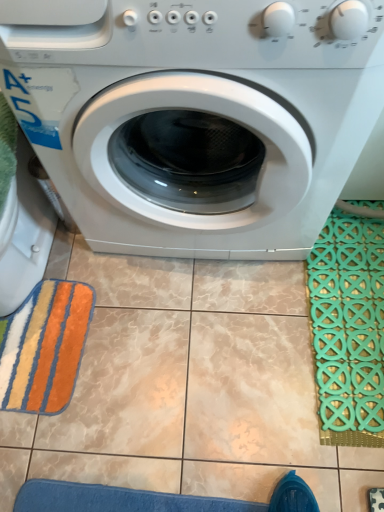
Question: Is green rubber bath mat at right taller than white glossy washing machine at center?

Choices:
 (A) no
 (B) yes

Answer: (A)

Question: From the image's perspective, is green rubber bath mat at right located above white glossy washing machine at center?

Choices:
 (A) no
 (B) yes

Answer: (A)

Question: Are green rubber bath mat at right and white glossy washing machine at center located far from each other?

Choices:
 (A) yes
 (B) no

Answer: (B)

Question: Considering the relative sizes of green rubber bath mat at right and white glossy washing machine at center in the image provided, is green rubber bath mat at right wider than white glossy washing machine at center?

Choices:
 (A) no
 (B) yes

Answer: (A)

Question: Does green rubber bath mat at right contain white glossy washing machine at center?

Choices:
 (A) no
 (B) yes

Answer: (A)

Question: Is the position of green rubber bath mat at right less distant than that of white glossy washing machine at center?

Choices:
 (A) yes
 (B) no

Answer: (B)

Question: Would you say white glossy washing machine at center is outside multicolored plush bath towel at lower left?

Choices:
 (A) yes
 (B) no

Answer: (A)

Question: Is white glossy washing machine at center facing towards multicolored plush bath towel at lower left?

Choices:
 (A) yes
 (B) no

Answer: (B)

Question: Can you confirm if white glossy washing machine at center is thinner than multicolored plush bath towel at lower left?

Choices:
 (A) no
 (B) yes

Answer: (A)

Question: From the image's perspective, would you say white glossy washing machine at center is positioned over multicolored plush bath towel at lower left?

Choices:
 (A) no
 (B) yes

Answer: (B)

Question: Considering the relative sizes of white glossy washing machine at center and multicolored plush bath towel at lower left in the image provided, is white glossy washing machine at center wider than multicolored plush bath towel at lower left?

Choices:
 (A) yes
 (B) no

Answer: (A)

Question: Is white glossy washing machine at center shorter than multicolored plush bath towel at lower left?

Choices:
 (A) no
 (B) yes

Answer: (A)

Question: Is multicolored plush bath towel at lower left completely or partially outside of white glossy washing machine at center?

Choices:
 (A) yes
 (B) no

Answer: (A)